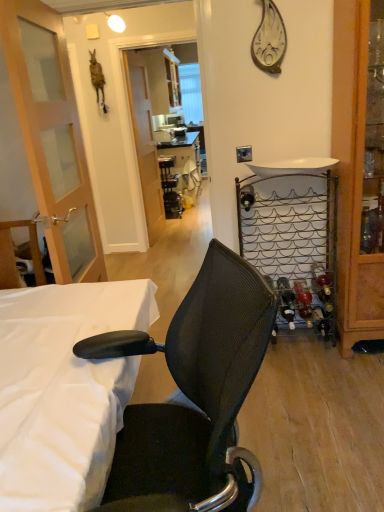
Question: Can you confirm if white fabric bed at lower left, placed as the 2th bed when sorted from back to front, is wider than white glossy sink at upper right?

Choices:
 (A) no
 (B) yes

Answer: (B)

Question: Are white fabric bed at lower left, the 1th bed when ordered from front to back, and white glossy sink at upper right located far from each other?

Choices:
 (A) no
 (B) yes

Answer: (B)

Question: Are white fabric bed at lower left, the 1th bed when ordered from front to back, and white glossy sink at upper right making contact?

Choices:
 (A) no
 (B) yes

Answer: (A)

Question: Does white fabric bed at lower left, the 1th bed when ordered from front to back, come behind white glossy sink at upper right?

Choices:
 (A) no
 (B) yes

Answer: (A)

Question: From the image's perspective, is white fabric bed at lower left, placed as the 2th bed when sorted from back to front, located above white glossy sink at upper right?

Choices:
 (A) yes
 (B) no

Answer: (B)

Question: From a real-world perspective, is white fabric bed at lower left, the 1th bed when ordered from front to back, physically located above or below white glossy sink at upper right?

Choices:
 (A) below
 (B) above

Answer: (A)

Question: In the image, is white fabric bed at lower left, which is the second bed in right-to-left order, on the left side or the right side of white glossy sink at upper right?

Choices:
 (A) right
 (B) left

Answer: (B)

Question: Is white fabric bed at lower left, which is the second bed in right-to-left order, spatially inside white glossy sink at upper right, or outside of it?

Choices:
 (A) outside
 (B) inside

Answer: (A)

Question: From the image's perspective, relative to white glossy sink at upper right, is white fabric bed at lower left, which is the second bed in right-to-left order, above or below?

Choices:
 (A) above
 (B) below

Answer: (B)

Question: Is metallic wire wine rack at right, arranged as the 2th bed when viewed from the left, in front of or behind white fabric bed at lower left, the 1th bed viewed from the left, in the image?

Choices:
 (A) front
 (B) behind

Answer: (B)

Question: Is metallic wire wine rack at right, the 2th bed in the front-to-back sequence, wider or thinner than white fabric bed at lower left, which is the second bed in right-to-left order?

Choices:
 (A) thin
 (B) wide

Answer: (A)

Question: Does point (271, 216) appear closer or farther from the camera than point (94, 285)?

Choices:
 (A) closer
 (B) farther

Answer: (B)

Question: Considering the relative positions of metallic wire wine rack at right, arranged as the 1th bed when viewed from the right, and white fabric bed at lower left, placed as the 2th bed when sorted from back to front, in the image provided, is metallic wire wine rack at right, arranged as the 1th bed when viewed from the right, to the left or to the right of white fabric bed at lower left, placed as the 2th bed when sorted from back to front,?

Choices:
 (A) left
 (B) right

Answer: (B)

Question: From the image's perspective, is wooden cabinet at right above or below white glossy sink at upper right?

Choices:
 (A) above
 (B) below

Answer: (B)

Question: Looking at the image, does wooden cabinet at right seem bigger or smaller compared to white glossy sink at upper right?

Choices:
 (A) big
 (B) small

Answer: (A)